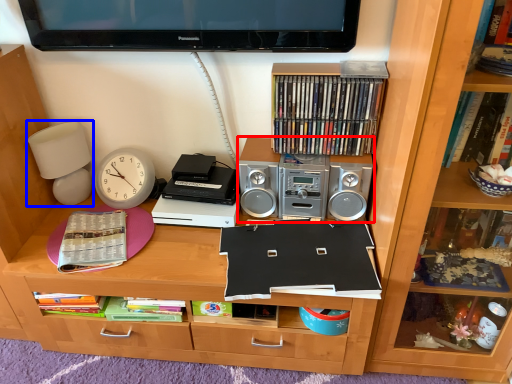
Question: Which object appears closest to the camera in this image, stereo (highlighted by a red box) or table lamp (highlighted by a blue box)?

Choices:
 (A) stereo
 (B) table lamp

Answer: (A)